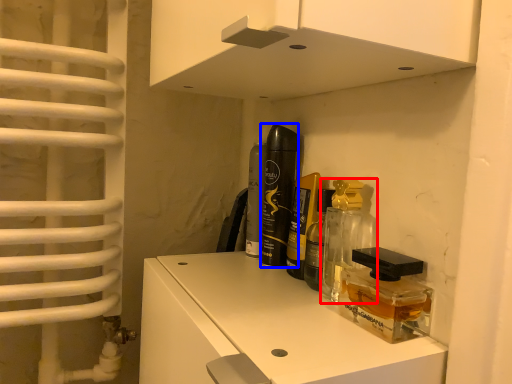
Question: Among these objects, which one is farthest to the camera, perfume (highlighted by a red box) or perfume (highlighted by a blue box)?

Choices:
 (A) perfume
 (B) perfume

Answer: (B)